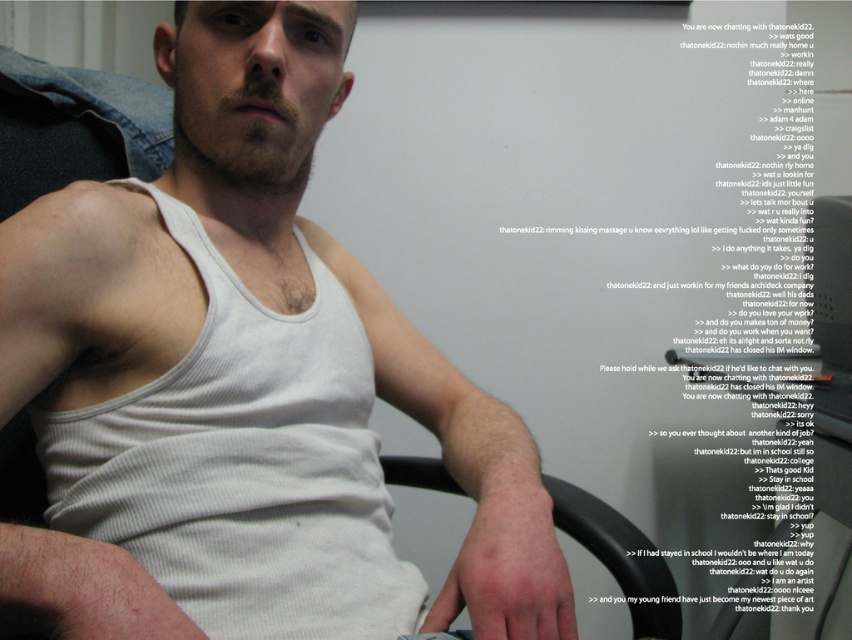
From the picture: You are a fashion designer observing the person in the image. You need to determine if the white ribbed tank top at center is close enough to the viewer to clearly see its texture. The minimum distance required to see the texture is 20 inches. Can you see the texture?

The white ribbed tank top at center is 21.53 inches from the viewer, which is within the minimum distance of 20 inches required to see the texture. Therefore, the texture can be clearly observed.

You are a photographer adjusting the lighting in the studio. You need to ensure that the white ribbed tank top at center and the black plastic computer chair at lower center are both visible in the photo. Since the tank top is in front of the chair, which object might require more lighting adjustments to ensure it doesn

The black plastic computer chair at lower center might require more lighting adjustments because it is behind the white ribbed tank top at center, which could block some light from reaching it, making it appear darker in the photo.